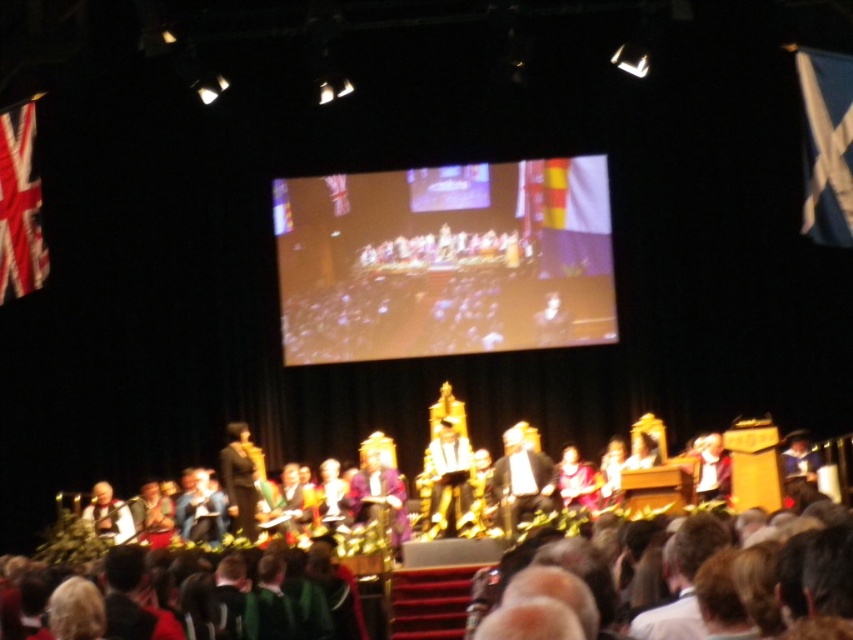
You are an event photographer positioned at the back of the stage. You need to capture a closeup shot of both the dark brown suit at center and the white fabric jacket at lower left. Given their sizes, which one might require you to zoom in more to fill the frame?

The dark brown suit at center has a lesser width compared to the white fabric jacket at lower left, so you would need to zoom in more to capture the dark brown suit at center to fill the frame.

You are an event photographer positioned at the back of the stage. You need to capture a clear photo of the dark brown suit at center and the white fabric at center. Which object will appear larger in your photo?

The dark brown suit at center will appear larger in the photo because it is closer to the viewer than the white fabric at center.

You are a photographer at the back of the stage. You need to capture a clear photo of both the dark brown suit at center and the white fabric at center. Which object should you focus on first to ensure it appears larger in the photo?

The dark brown suit at center has a larger size compared to white fabric at center, so you should focus on the dark brown suit at center first to ensure it appears larger in the photo.